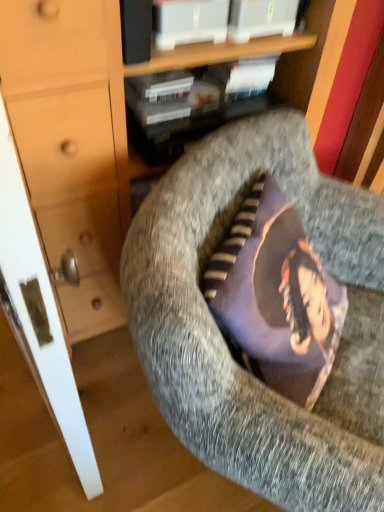
Question: Would you say matte black book at upper center is part of textured gray cushion at center's contents?

Choices:
 (A) no
 (B) yes

Answer: (A)

Question: Does textured gray cushion at center have a larger size compared to matte black book at upper center?

Choices:
 (A) no
 (B) yes

Answer: (B)

Question: Does textured gray cushion at center turn towards matte black book at upper center?

Choices:
 (A) no
 (B) yes

Answer: (A)

Question: Considering the relative positions of textured gray cushion at center and matte black book at upper center in the image provided, is textured gray cushion at center to the left of matte black book at upper center from the viewer's perspective?

Choices:
 (A) no
 (B) yes

Answer: (A)

Question: Are textured gray cushion at center and matte black book at upper center making contact?

Choices:
 (A) no
 (B) yes

Answer: (A)

Question: From the image's perspective, is textured gray cushion at center located beneath matte black book at upper center?

Choices:
 (A) no
 (B) yes

Answer: (B)

Question: Is matte black book at upper center a part of matte wood dresser at center?

Choices:
 (A) no
 (B) yes

Answer: (B)

Question: Could you tell me if matte wood dresser at center is turned towards matte black book at upper center?

Choices:
 (A) yes
 (B) no

Answer: (A)

Question: Is matte wood dresser at center positioned with its back to matte black book at upper center?

Choices:
 (A) yes
 (B) no

Answer: (A)

Question: Would you say matte wood dresser at center is a long distance from matte black book at upper center?

Choices:
 (A) no
 (B) yes

Answer: (A)

Question: Is matte wood dresser at center smaller than matte black book at upper center?

Choices:
 (A) yes
 (B) no

Answer: (B)

Question: Can we say matte wood dresser at center lies outside matte black book at upper center?

Choices:
 (A) yes
 (B) no

Answer: (A)

Question: Is matte black book at upper center touching matte wood dresser at center?

Choices:
 (A) yes
 (B) no

Answer: (B)